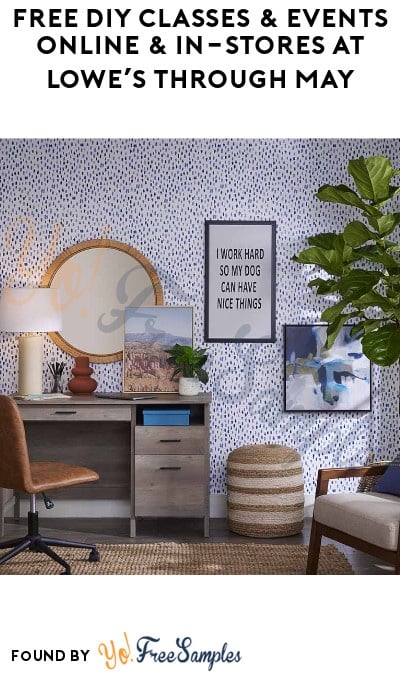
I want to click on pouf, so click(x=272, y=491).